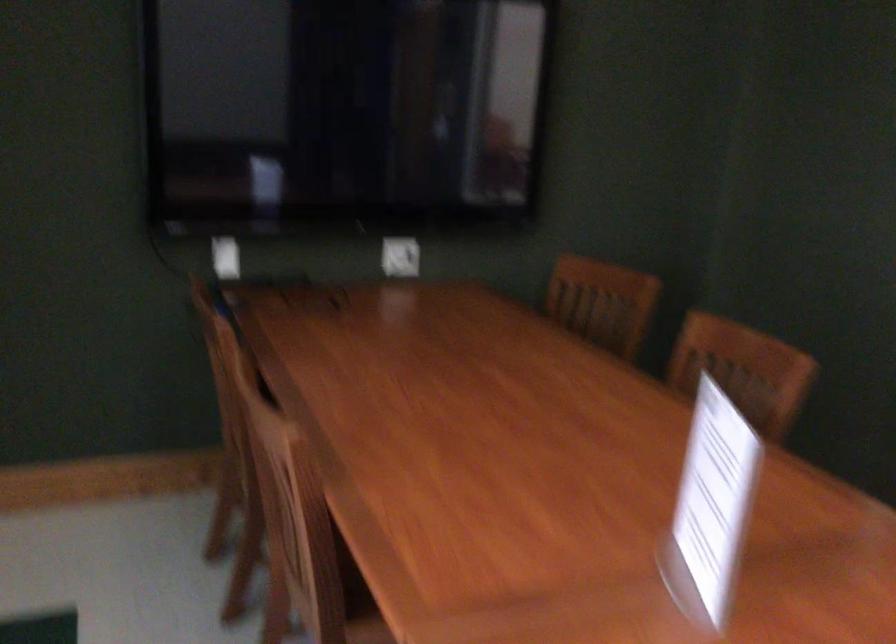
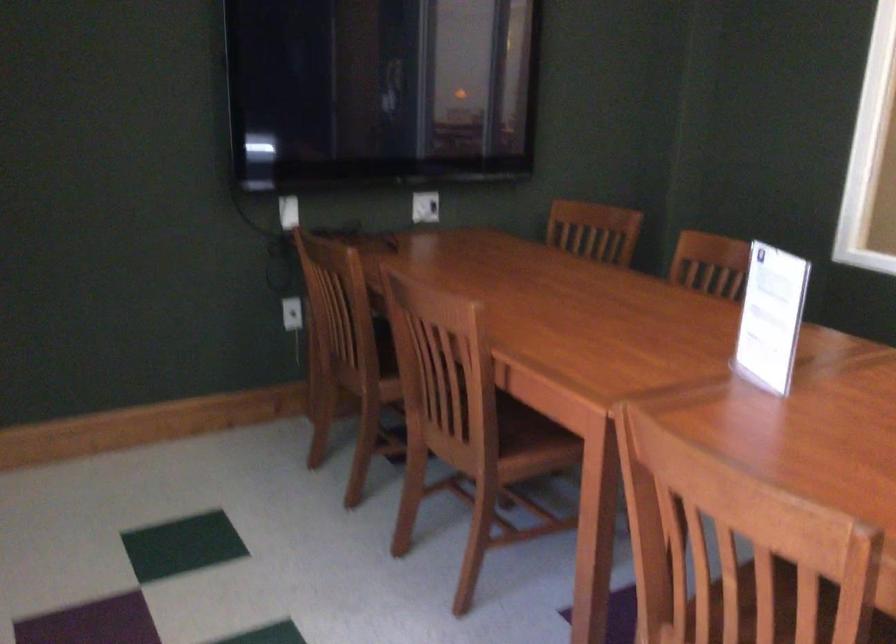
Which direction would the cameraman need to move to produce the second image?

The cameraman walked toward left, backward.